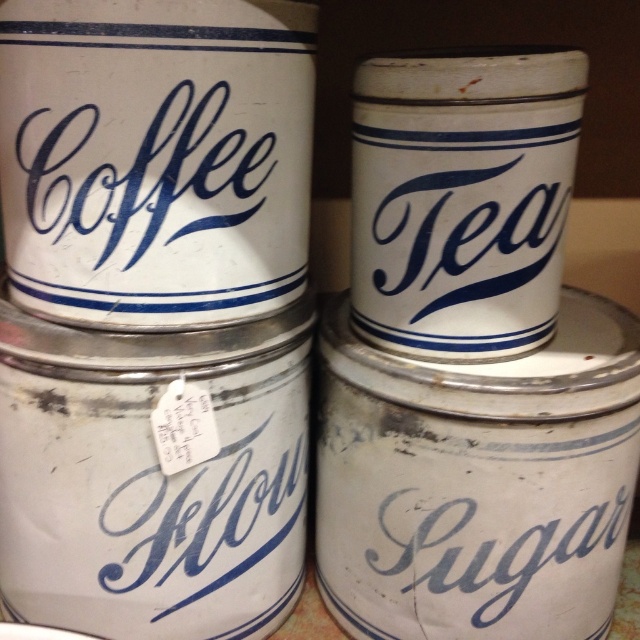
Question: From the image, what is the correct spatial relationship of blue painted metal tea at upper right in relation to matte blue script coffee at upper left?

Choices:
 (A) right
 (B) left

Answer: (A)

Question: Which object is farther from the camera taking this photo?

Choices:
 (A) white paper tag at lower center
 (B) white matte sugar at lower right

Answer: (B)

Question: Which point is farther to the camera?

Choices:
 (A) white paper tag at lower center
 (B) white matte sugar at lower right
 (C) matte blue script coffee at upper left
 (D) blue painted metal tea at upper right

Answer: (B)

Question: Which point is farther from the camera taking this photo?

Choices:
 (A) (259, 506)
 (B) (493, 604)

Answer: (A)

Question: Does matte blue script coffee at upper left appear on the left side of white paper tag at lower center?

Choices:
 (A) no
 (B) yes

Answer: (B)

Question: Is blue painted metal tea at upper right to the right of white paper tag at lower center from the viewer's perspective?

Choices:
 (A) yes
 (B) no

Answer: (A)